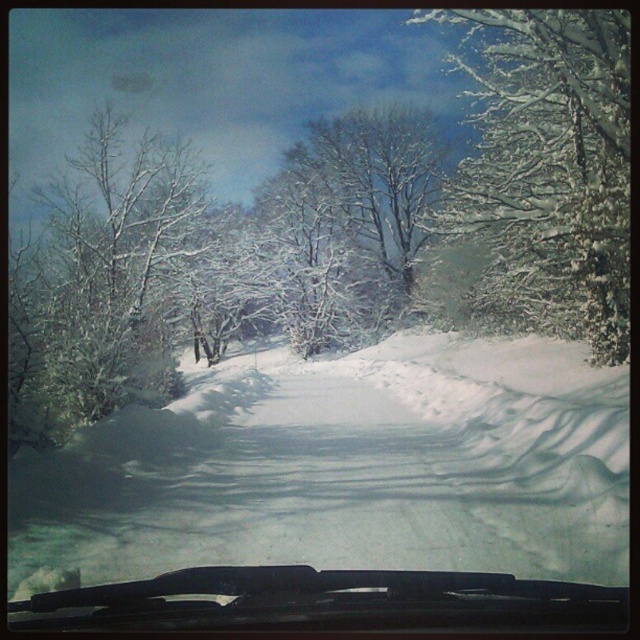
Can you confirm if white fluffy snow at center is wider than white snow-covered tree at right?

Indeed, white fluffy snow at center has a greater width compared to white snow-covered tree at right.

Image resolution: width=640 pixels, height=640 pixels. What do you see at coordinates (372, 472) in the screenshot? I see `white fluffy snow at center` at bounding box center [372, 472].

Between point (186, 481) and point (593, 29), which one is positioned in front?

Point (186, 481) is more forward.

In order to click on white fluffy snow at center in this screenshot , I will do `click(372, 472)`.

Does white fluffy snow at center lie behind transparent glass windshield at center?

Yes, it is.

Can you confirm if white fluffy snow at center is taller than transparent glass windshield at center?

Indeed, white fluffy snow at center has a greater height compared to transparent glass windshield at center.

Between point (563, 445) and point (372, 620), which one is positioned in front?

Point (372, 620) is more forward.

The height and width of the screenshot is (640, 640). In order to click on white fluffy snow at center in this screenshot , I will do `click(372, 472)`.

Is white fluffy snow at center further to the viewer compared to white snow-covered tree at left?

No, white fluffy snow at center is closer to the viewer.

Which is above, white fluffy snow at center or white snow-covered tree at left?

white snow-covered tree at left is above.

Which is behind, point (44, 532) or point (54, 296)?

Point (54, 296)

Find the location of a particular element. The width and height of the screenshot is (640, 640). white fluffy snow at center is located at coordinates (372, 472).